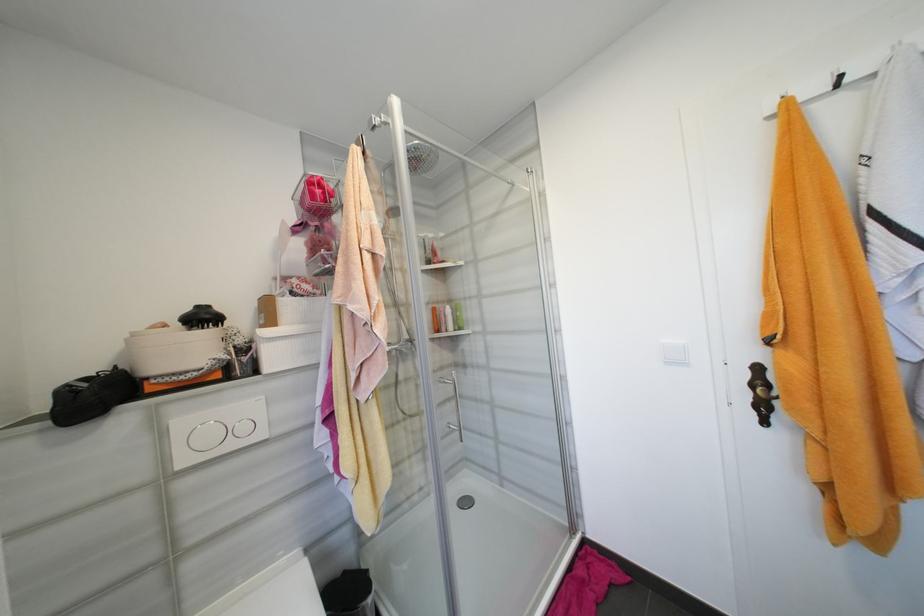
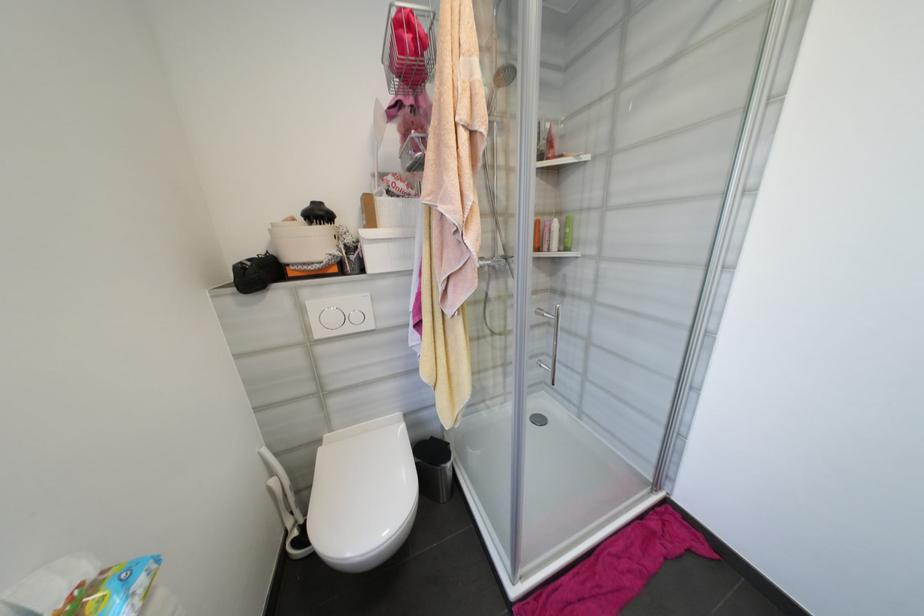
Where in the second image is the point corresponding to the point at 472,460 from the first image?

(552, 384)